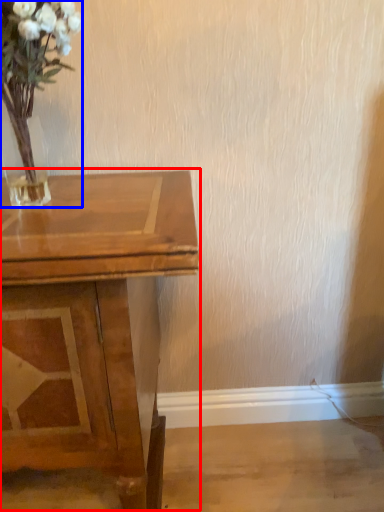
Question: Which of the following is the farthest to the observer, table (highlighted by a red box) or floral arrangement (highlighted by a blue box)?

Choices:
 (A) table
 (B) floral arrangement

Answer: (A)